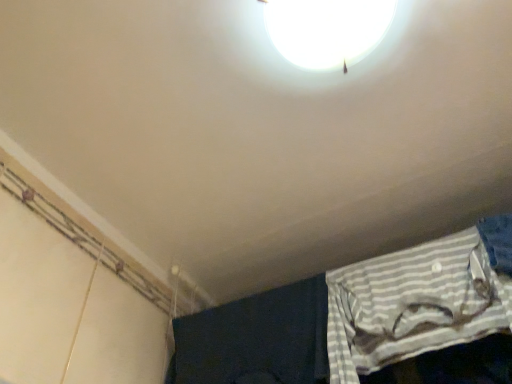
Describe the element at coordinates (327, 30) in the screenshot. The image size is (512, 384). I see `white glossy lamp at upper center` at that location.

This screenshot has width=512, height=384. Identify the location of white glossy lamp at upper center. (327, 30).

You are a GUI agent. You are given a task and a screenshot of the screen. Output one action in this format:
    pyautogui.click(x=<x>, y=<y>)
    Task: Click on the white striped fabric at lower right
    This screenshot has height=384, width=512.
    Given the screenshot: What is the action you would take?
    pyautogui.click(x=413, y=304)

The image size is (512, 384). What do you see at coordinates (413, 304) in the screenshot?
I see `white striped fabric at lower right` at bounding box center [413, 304].

Where is `white glossy lamp at upper center`? This screenshot has width=512, height=384. white glossy lamp at upper center is located at coordinates (327, 30).

Between white glossy lamp at upper center and white striped fabric at lower right, which one appears on the left side from the viewer's perspective?

From the viewer's perspective, white glossy lamp at upper center appears more on the left side.

Based on the photo, relative to white striped fabric at lower right, is white glossy lamp at upper center in front or behind?

In the image, white glossy lamp at upper center appears in front of white striped fabric at lower right.

Which is nearer, (337, 54) or (377, 276)?

Point (337, 54) is positioned closer to the camera compared to point (377, 276).

From the image's perspective, which one is positioned higher, white glossy lamp at upper center or white striped fabric at lower right?

From the image's view, white glossy lamp at upper center is above.

From a real-world perspective, is white glossy lamp at upper center physically above white striped fabric at lower right?

Yes.

In terms of width, does white glossy lamp at upper center look wider or thinner when compared to white striped fabric at lower right?

white glossy lamp at upper center is wider than white striped fabric at lower right.

Between white glossy lamp at upper center and white striped fabric at lower right, which one has more height?

Standing taller between the two is white striped fabric at lower right.

Is white glossy lamp at upper center bigger or smaller than white striped fabric at lower right?

white glossy lamp at upper center is smaller than white striped fabric at lower right.

Is white glossy lamp at upper center situated inside white striped fabric at lower right or outside?

white glossy lamp at upper center cannot be found inside white striped fabric at lower right.

Looking at this image, are white glossy lamp at upper center and white striped fabric at lower right beside each other?

No, white glossy lamp at upper center is not touching white striped fabric at lower right.

Is white glossy lamp at upper center looking in the opposite direction of white striped fabric at lower right?

No.

Can you tell me how much white glossy lamp at upper center and white striped fabric at lower right differ in facing direction?

white glossy lamp at upper center and white striped fabric at lower right are facing 90 degrees away from each other.

Measure the distance from white glossy lamp at upper center to white striped fabric at lower right.

white glossy lamp at upper center and white striped fabric at lower right are 21.16 inches apart from each other.

Find the location of a particular element. The width and height of the screenshot is (512, 384). curtain below the white glossy lamp at upper center (from the image's perspective) is located at coordinates (413, 304).

Which object is positioned more to the right, white striped fabric at lower right or white glossy lamp at upper center?

Positioned to the right is white striped fabric at lower right.

Is white striped fabric at lower right further to camera compared to white glossy lamp at upper center?

Yes, it is behind white glossy lamp at upper center.

Does point (418, 328) lie in front of point (362, 47)?

No, (418, 328) is behind (362, 47).

From the image's perspective, relative to white glossy lamp at upper center, is white striped fabric at lower right above or below?

From the image's perspective, white striped fabric at lower right appears below white glossy lamp at upper center.

From a real-world perspective, which is physically above, white striped fabric at lower right or white glossy lamp at upper center?

white glossy lamp at upper center.

Considering the sizes of white striped fabric at lower right and white glossy lamp at upper center in the image, is white striped fabric at lower right wider or thinner than white glossy lamp at upper center?

Considering their sizes, white striped fabric at lower right looks slimmer than white glossy lamp at upper center.

Considering the relative sizes of white striped fabric at lower right and white glossy lamp at upper center in the image provided, is white striped fabric at lower right shorter than white glossy lamp at upper center?

Incorrect, the height of white striped fabric at lower right does not fall short of that of white glossy lamp at upper center.

Considering the relative sizes of white striped fabric at lower right and white glossy lamp at upper center in the image provided, is white striped fabric at lower right smaller than white glossy lamp at upper center?

Actually, white striped fabric at lower right might be larger than white glossy lamp at upper center.

Choose the correct answer: Is white striped fabric at lower right inside white glossy lamp at upper center or outside it?

white striped fabric at lower right lies outside white glossy lamp at upper center.

Are white striped fabric at lower right and white glossy lamp at upper center beside each other?

There is a gap between white striped fabric at lower right and white glossy lamp at upper center.

Is white striped fabric at lower right oriented towards white glossy lamp at upper center?

Yes, white striped fabric at lower right is turned towards white glossy lamp at upper center.

At what (x,y) coordinates should I click in order to perform the action: click on curtain lying behind the white glossy lamp at upper center. Please return your answer as a coordinate pair (x, y). The image size is (512, 384). Looking at the image, I should click on (413, 304).

Locate an element on the screen. This screenshot has width=512, height=384. curtain below the white glossy lamp at upper center (from a real-world perspective) is located at coordinates (413, 304).

Find the location of a particular element. This screenshot has width=512, height=384. lamp on the left of the white striped fabric at lower right is located at coordinates (327, 30).